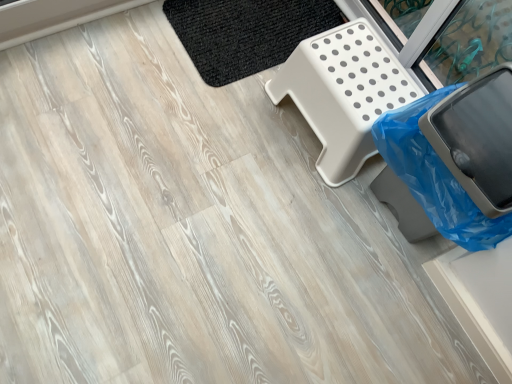
I want to click on free area below black woven mat at upper center (from a real-world perspective), so click(238, 25).